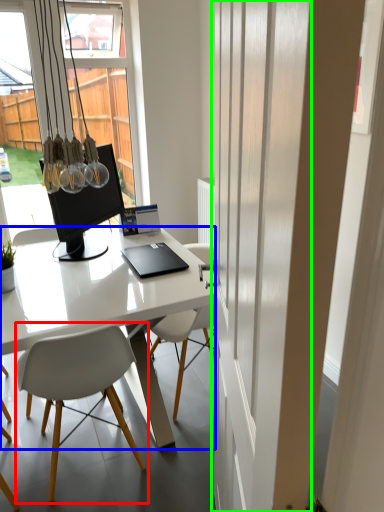
Question: Which object is the closest to the chair (highlighted by a red box)? Choose among these: desk (highlighted by a blue box) or screen door (highlighted by a green box).

Choices:
 (A) desk
 (B) screen door

Answer: (A)